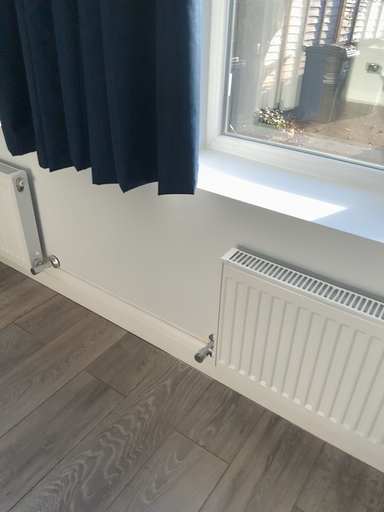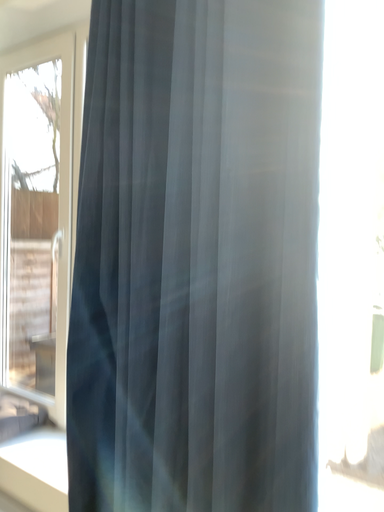
Question: How did the camera likely rotate when shooting the video?

Choices:
 (A) rotated upward
 (B) rotated downward

Answer: (A)